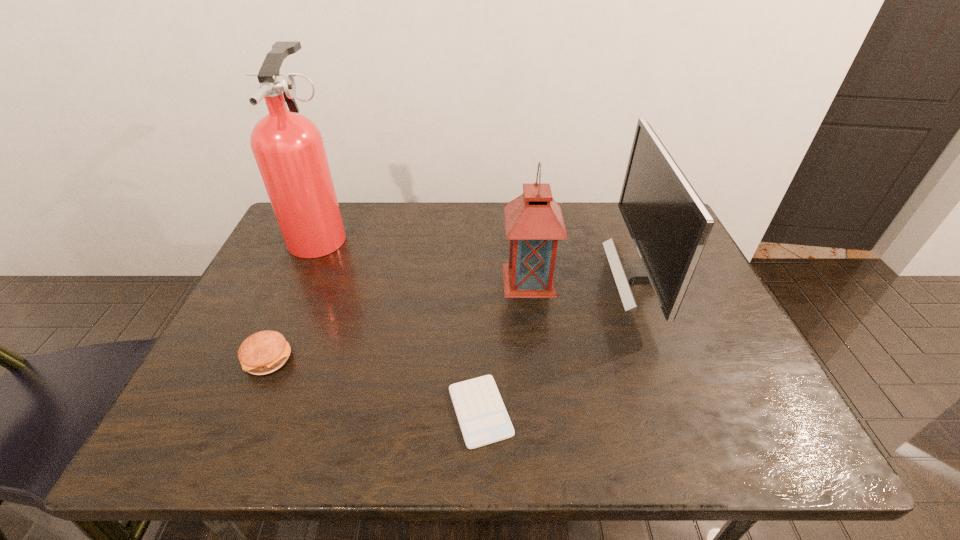
Identify the location of free space between the lantern and the second shortest object. This screenshot has height=540, width=960. (398, 320).

Image resolution: width=960 pixels, height=540 pixels. I want to click on free spot between the monitor and the hamburger, so click(455, 317).

At what (x,y) coordinates should I click in order to perform the action: click on empty location between the lantern and the fire extinguisher. Please return your answer as a coordinate pair (x, y). This screenshot has height=540, width=960. Looking at the image, I should click on (425, 257).

Identify the location of empty space between the rightmost object and the calculator. (561, 343).

Locate an element on the screen. The width and height of the screenshot is (960, 540). free spot between the lantern and the tallest object is located at coordinates (425, 257).

Identify the location of vacant point located between the fourth tallest object and the fire extinguisher. The width and height of the screenshot is (960, 540). (295, 296).

Where is `object that is the third closest to the rightmost object`? object that is the third closest to the rightmost object is located at coordinates (288, 147).

Locate an element on the screen. This screenshot has width=960, height=540. the closest object relative to the fire extinguisher is located at coordinates (264, 352).

The image size is (960, 540). Find the location of `free location that satisfies the following two spatial constraints: 1. on the front side of the hamburger; 2. on the left side of the shortest object`. free location that satisfies the following two spatial constraints: 1. on the front side of the hamburger; 2. on the left side of the shortest object is located at coordinates (246, 411).